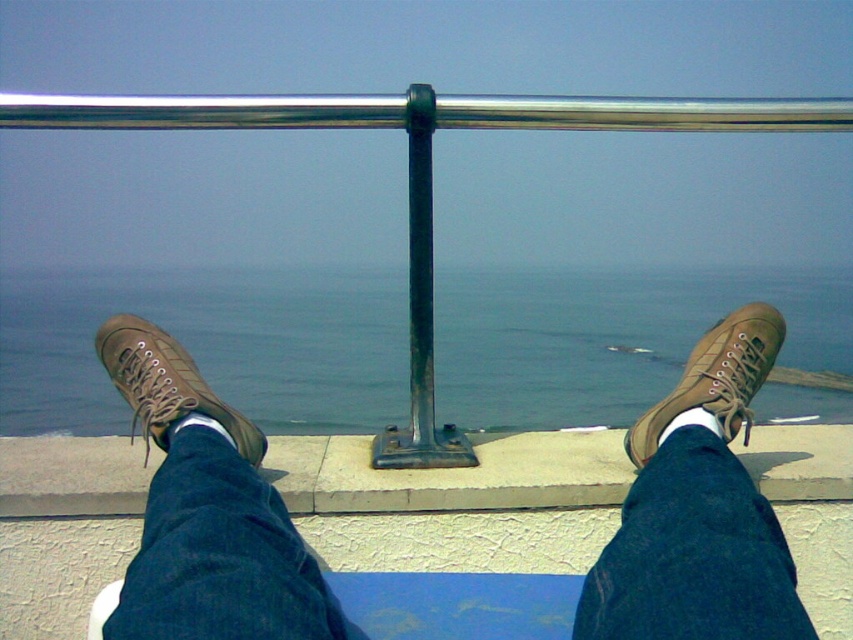
You are standing on the smooth concrete ledge at center, and you need to reach the metal railing that is just above your head. Considering your height is 5 feet 6 inches, can you comfortably reach the railing without stretching?

The smooth concrete ledge at center and viewer are 5.20 feet apart from each other. Since the viewer is 5 feet 6 inches tall, they can comfortably reach the metal railing without stretching as the distance is within their reach.

You are standing at the seaside and want to know which of the two points, point (592, 467) or point (743, 113), is closer to you. Based on the scene, can you determine which point is nearer?

Point (592, 467) is closer to the camera than point (743, 113).

You are standing at the seaside and see the metallic pole at center. If you were to walk directly towards the pole, which direction should you move relative to your current position?

The metallic pole at center is located at the center of the image, so you should walk straight ahead to reach it.